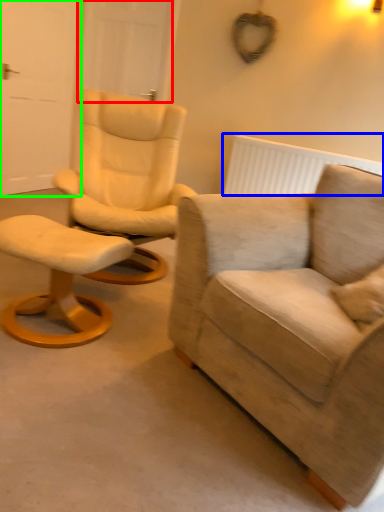
Question: Which is farther away from door (highlighted by a red box)? radiator (highlighted by a blue box) or door (highlighted by a green box)?

Choices:
 (A) radiator
 (B) door

Answer: (A)